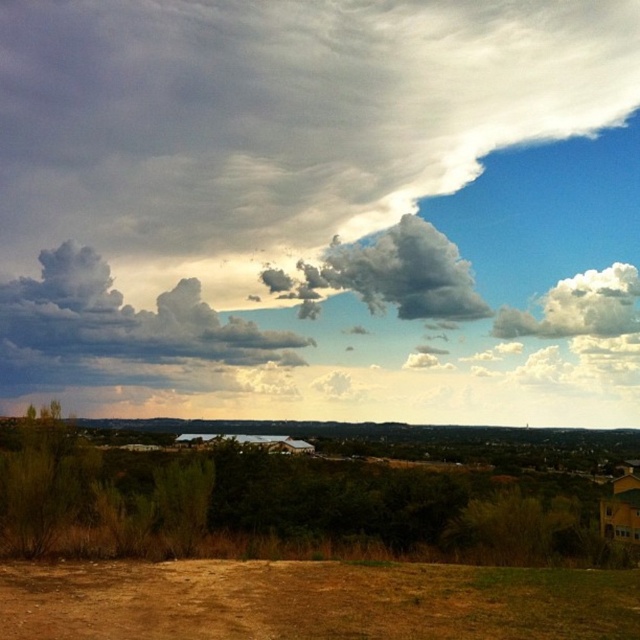
Question: Which object is the farthest from the brown dirt field at lower center?

Choices:
 (A) clear glass lake at center
 (B) white fluffy cloud at upper center
 (C) gray fluffy cloud at upper center
 (D) white fluffy cloud at upper right

Answer: (D)

Question: Which object is the farthest from the white fluffy cloud at upper right?

Choices:
 (A) cloudy cotton at upper left
 (B) white fluffy cloud at upper center
 (C) gray fluffy cloud at upper center
 (D) clear glass lake at center

Answer: (D)

Question: Does gray fluffy cloud at upper center come behind white fluffy cloud at upper right?

Choices:
 (A) yes
 (B) no

Answer: (B)

Question: Is cloudy cotton at upper left above white fluffy cloud at upper right?

Choices:
 (A) no
 (B) yes

Answer: (A)

Question: Observing the image, what is the correct spatial positioning of cloudy cotton at upper left in reference to clear glass lake at center?

Choices:
 (A) above
 (B) below

Answer: (A)

Question: Which object appears closest to the camera in this image?

Choices:
 (A) white fluffy cloud at upper center
 (B) gray fluffy cloud at upper center
 (C) cloudy cotton at upper left

Answer: (C)